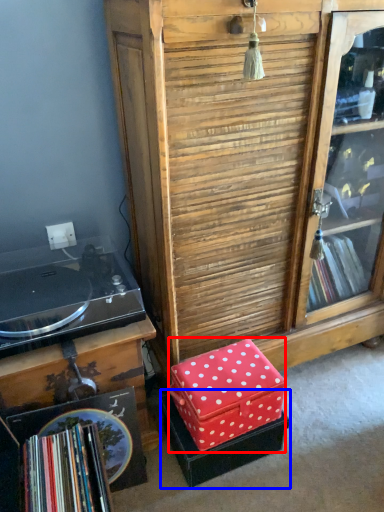
Question: Among these objects, which one is nearest to the camera, storage box (highlighted by a red box) or storage box (highlighted by a blue box)?

Choices:
 (A) storage box
 (B) storage box

Answer: (A)